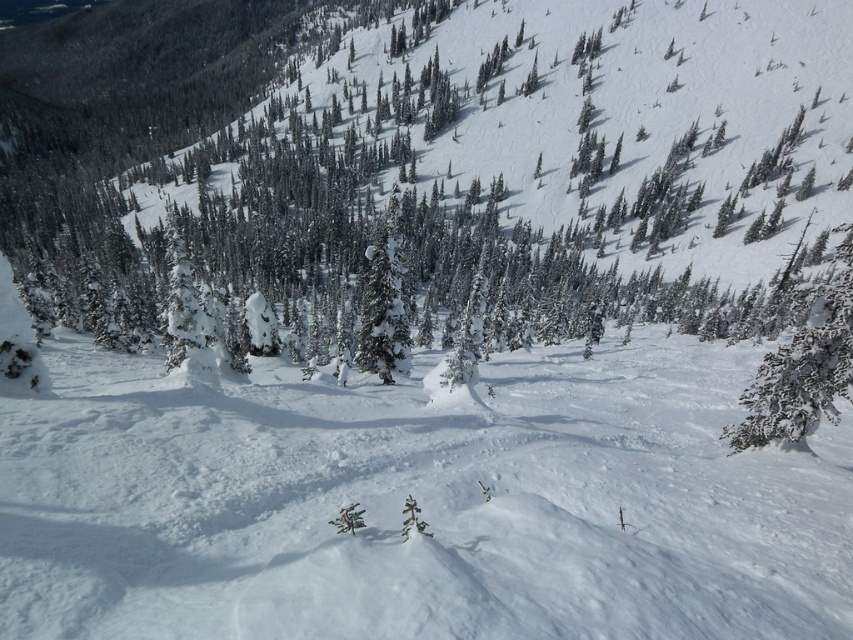
Can you confirm if white snow at center is positioned below snow-covered evergreen tree at center?

Yes.

You are a GUI agent. You are given a task and a screenshot of the screen. Output one action in this format:
    pyautogui.click(x=<x>, y=<y>)
    Task: Click on the white snow at center
    
    Given the screenshot: What is the action you would take?
    pyautogui.click(x=418, y=504)

The image size is (853, 640). In order to click on white snow at center in this screenshot , I will do [418, 504].

Where is `white snow at center`? The image size is (853, 640). white snow at center is located at coordinates (418, 504).

Does white snow at center have a lesser width compared to snow-covered evergreen at lower right?

Indeed, white snow at center has a lesser width compared to snow-covered evergreen at lower right.

Is white snow at center shorter than snow-covered evergreen at lower right?

Yes.

Between point (850, 532) and point (759, 435), which one is positioned in front?

Point (850, 532) is in front.

Locate an element on the screen. The image size is (853, 640). white snow at center is located at coordinates (418, 504).

Who is higher up, snow-covered evergreen at lower right or snow-covered evergreen tree at center?

snow-covered evergreen tree at center is above.

Describe the element at coordinates (804, 364) in the screenshot. I see `snow-covered evergreen at lower right` at that location.

Locate an element on the screen. The height and width of the screenshot is (640, 853). snow-covered evergreen at lower right is located at coordinates (804, 364).